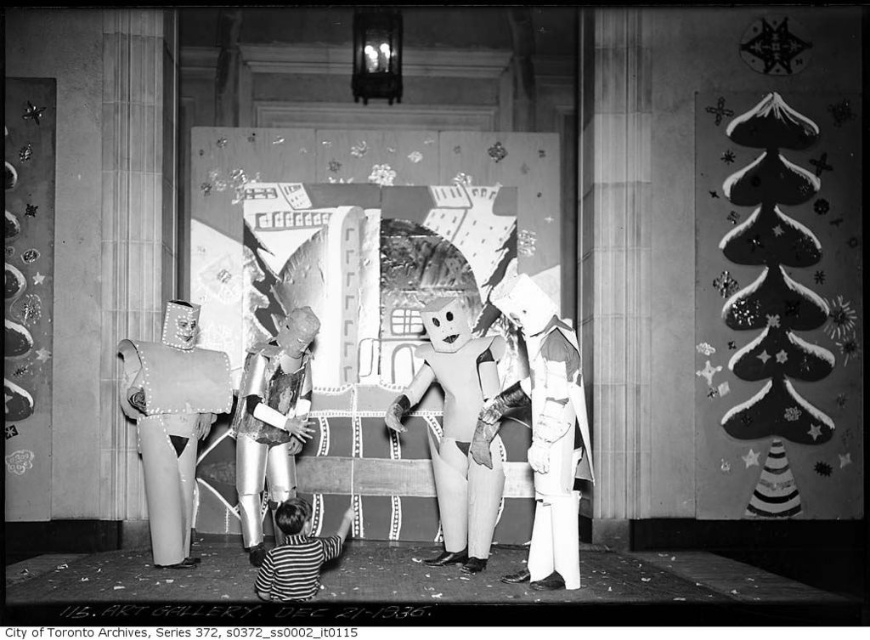
Can you confirm if black paper christmas tree at right is positioned above cardboard robot at center?

Indeed, black paper christmas tree at right is positioned over cardboard robot at center.

Who is higher up, black paper christmas tree at right or cardboard robot at center?

Positioned higher is black paper christmas tree at right.

Does point (781, 220) come closer to viewer compared to point (531, 557)?

No, (781, 220) is behind (531, 557).

Find the location of `black paper christmas tree at right`. black paper christmas tree at right is located at coordinates (774, 298).

How far apart are shiny silver robot at center and striped cotton shirt at lower center?

shiny silver robot at center is 32.84 inches away from striped cotton shirt at lower center.

Does shiny silver robot at center have a lesser height compared to striped cotton shirt at lower center?

In fact, shiny silver robot at center may be taller than striped cotton shirt at lower center.

Measure the distance between shiny silver robot at center and camera.

shiny silver robot at center and camera are 16.88 feet apart from each other.

The height and width of the screenshot is (640, 870). Identify the location of shiny silver robot at center. (271, 420).

Is point (741, 364) positioned behind point (298, 438)?

Yes, point (741, 364) is farther from viewer.

Can you confirm if black paper christmas tree at right is taller than shiny silver robot at center?

Yes.

Locate an element on the screen. This screenshot has height=640, width=870. black paper christmas tree at right is located at coordinates (774, 298).